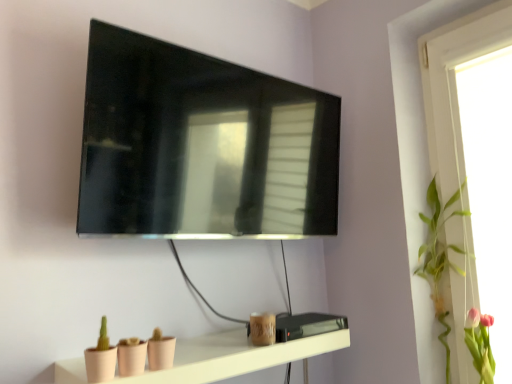
Question: Does green leafy plant at upper right have a lesser width compared to pink silk flower at upper right?

Choices:
 (A) yes
 (B) no

Answer: (B)

Question: Is the position of green leafy plant at upper right more distant than that of pink silk flower at upper right?

Choices:
 (A) no
 (B) yes

Answer: (B)

Question: From a real-world perspective, is green leafy plant at upper right physically below pink silk flower at upper right?

Choices:
 (A) no
 (B) yes

Answer: (A)

Question: Is the depth of green leafy plant at upper right less than that of pink silk flower at upper right?

Choices:
 (A) yes
 (B) no

Answer: (B)

Question: Does green leafy plant at upper right touch pink silk flower at upper right?

Choices:
 (A) no
 (B) yes

Answer: (A)

Question: Relative to pink silk flower at upper right, is green leafy plant at upper right in front or behind?

Choices:
 (A) front
 (B) behind

Answer: (B)

Question: From a real-world perspective, is green leafy plant at upper right positioned above or below pink silk flower at upper right?

Choices:
 (A) below
 (B) above

Answer: (B)

Question: Is point (449, 200) closer or farther from the camera than point (482, 365)?

Choices:
 (A) farther
 (B) closer

Answer: (A)

Question: From the image's perspective, is green leafy plant at upper right located above or below pink silk flower at upper right?

Choices:
 (A) below
 (B) above

Answer: (B)

Question: Visually, is matte pink shelf at lower center positioned to the left or to the right of pink silk flower at upper right?

Choices:
 (A) left
 (B) right

Answer: (A)

Question: From the image's perspective, is matte pink shelf at lower center positioned above or below pink silk flower at upper right?

Choices:
 (A) above
 (B) below

Answer: (A)

Question: Looking at their shapes, would you say matte pink shelf at lower center is wider or thinner than pink silk flower at upper right?

Choices:
 (A) thin
 (B) wide

Answer: (B)

Question: Would you say matte pink shelf at lower center is inside or outside pink silk flower at upper right?

Choices:
 (A) inside
 (B) outside

Answer: (B)

Question: Would you say matte black tv at upper center is to the left or to the right of green leafy plant at upper right in the picture?

Choices:
 (A) right
 (B) left

Answer: (B)

Question: From the image's perspective, is matte black tv at upper center above or below green leafy plant at upper right?

Choices:
 (A) below
 (B) above

Answer: (B)